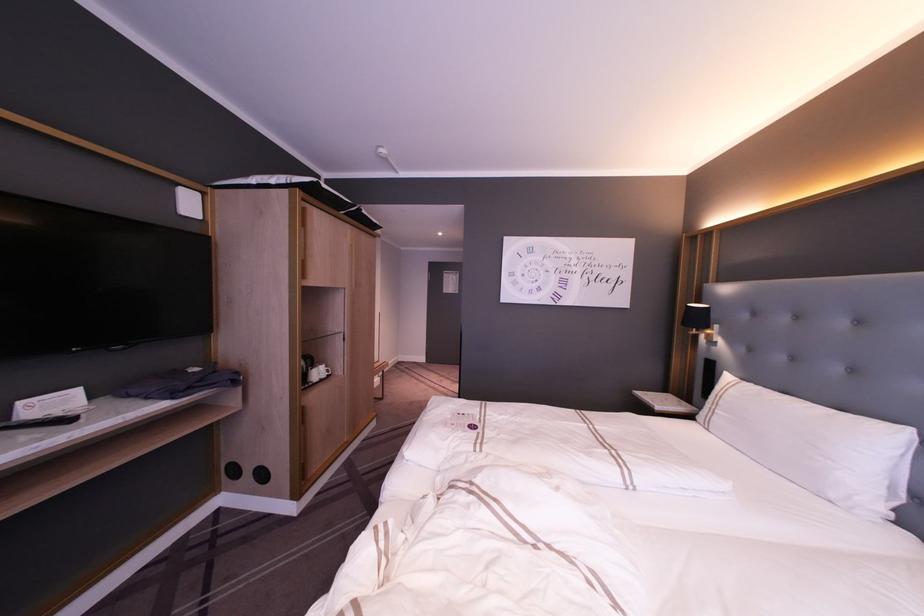
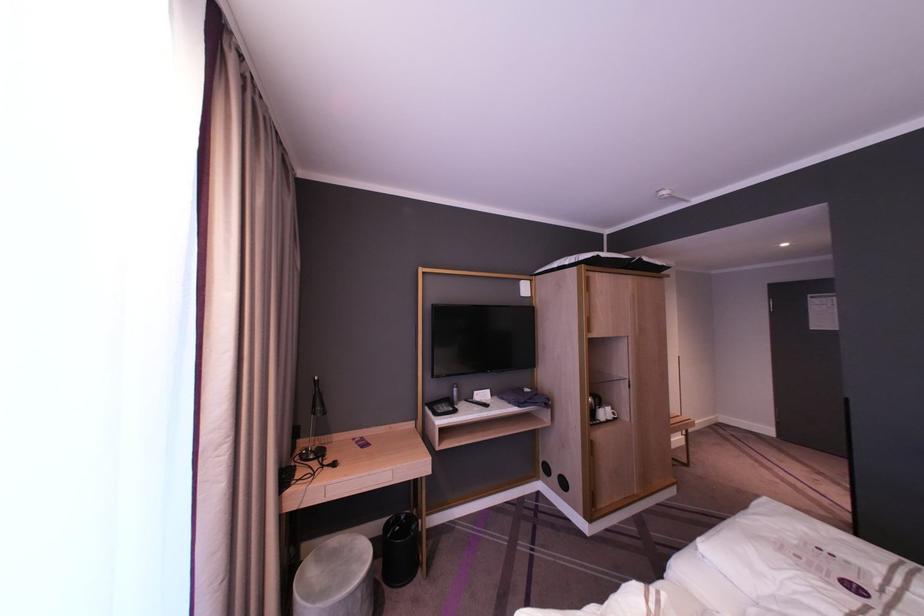
The point at (321, 379) is marked in the first image. Where is the corresponding point in the second image?

(606, 421)